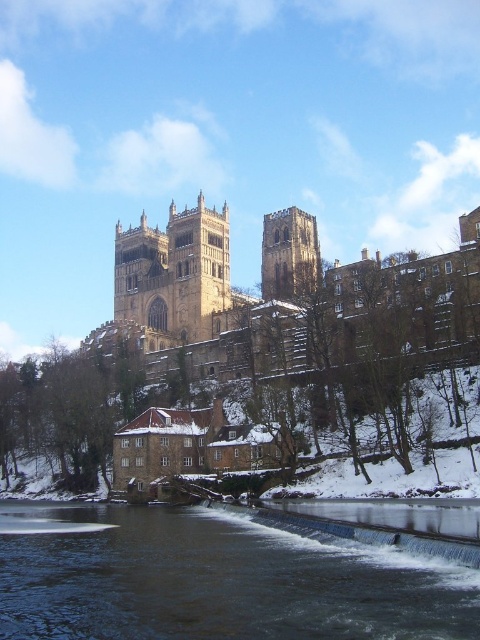
You are a drone operator planning to fly a drone between the golden stone tower at center and the brown stone tower at center. The drone has a wingspan of 1.2 meters. Can the drone safely navigate the space between them?

The golden stone tower at center and brown stone tower at center are 12.56 meters apart from each other. Since the drone has a wingspan of 1.2 meters, it can safely navigate the space between them as the distance is much larger than the drone size.

You are planning to take a photo of Durham Cathedral. You want to capture both the dark gray water at lower center and the golden stone tower at center in the same frame. Which object should you focus on to ensure both are visible without zooming in too much?

You should focus on the dark gray water at lower center because its width surpasses that of the golden stone tower at center, allowing more space to include both in the frame.